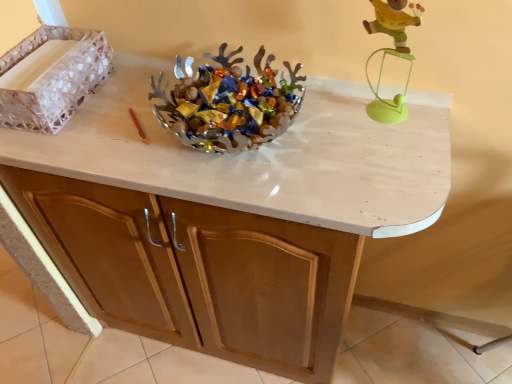
Find the location of `free space above white textured tray at left (from a real-world perspective)`. free space above white textured tray at left (from a real-world perspective) is located at coordinates (40, 64).